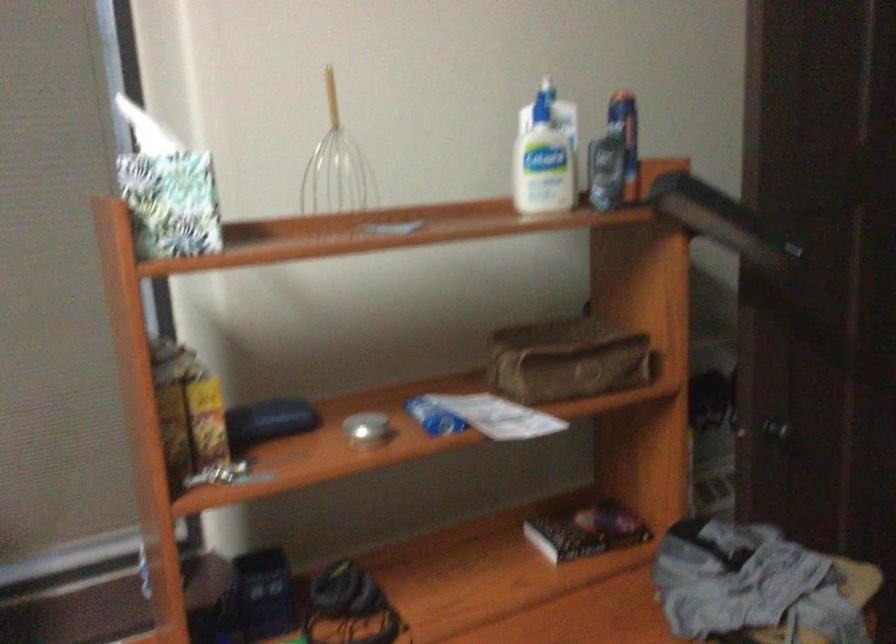
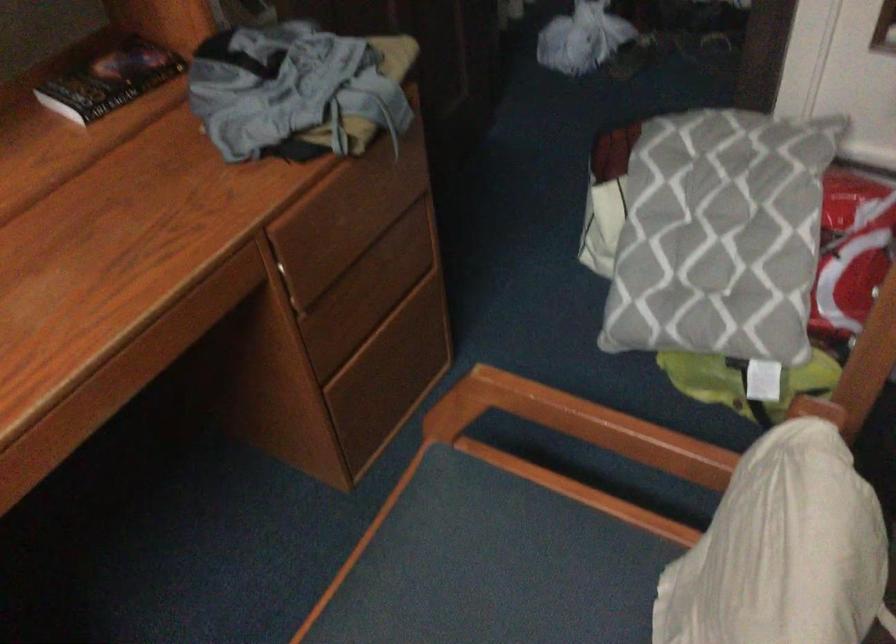
The first image is from the beginning of the video and the second image is from the end. How did the camera likely rotate when shooting the video?

The camera's rotation is toward right-down.